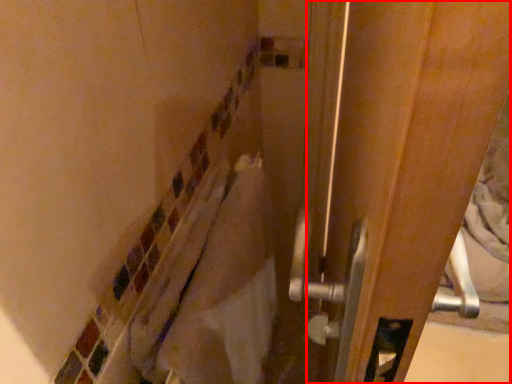
Question: From the image's perspective, where is screen door (annotated by the red box) located relative to material?

Choices:
 (A) below
 (B) above

Answer: (B)